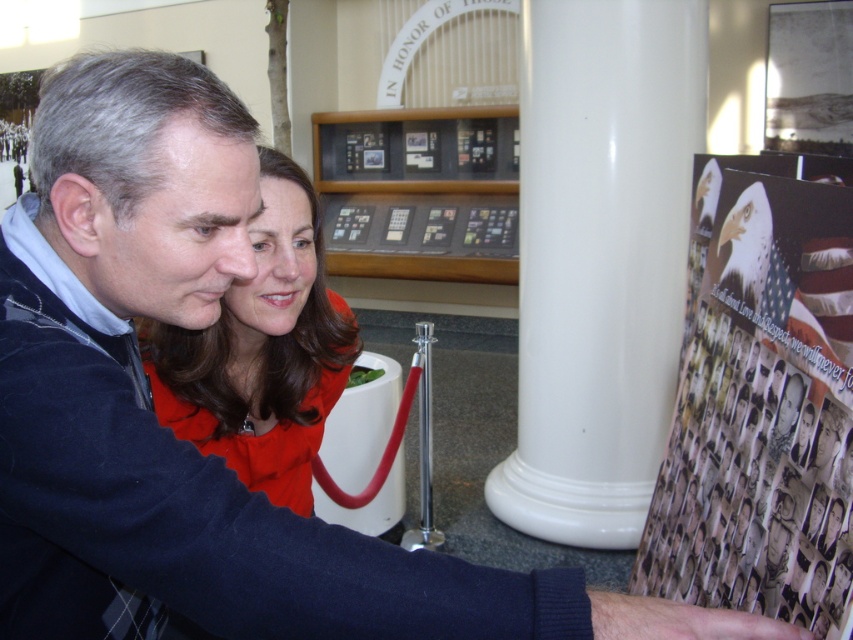
Question: Can you confirm if white glossy column at center is thinner than printed paper poster at right?

Choices:
 (A) no
 (B) yes

Answer: (A)

Question: Does printed paper poster at right appear over black glass display case at center?

Choices:
 (A) no
 (B) yes

Answer: (A)

Question: Which object appears farthest from the camera in this image?

Choices:
 (A) white glossy column at center
 (B) printed paper poster at right

Answer: (A)

Question: Among these objects, which one is farthest from the camera?

Choices:
 (A) black glass display case at center
 (B) matte red dress at center
 (C) white glossy column at center

Answer: (A)

Question: Is the position of printed paper poster at right more distant than that of black glass display case at center?

Choices:
 (A) yes
 (B) no

Answer: (B)

Question: Which point appears farthest from the camera in this image?

Choices:
 (A) (618, 244)
 (B) (724, 176)
 (C) (280, 195)
 (D) (498, 259)

Answer: (D)